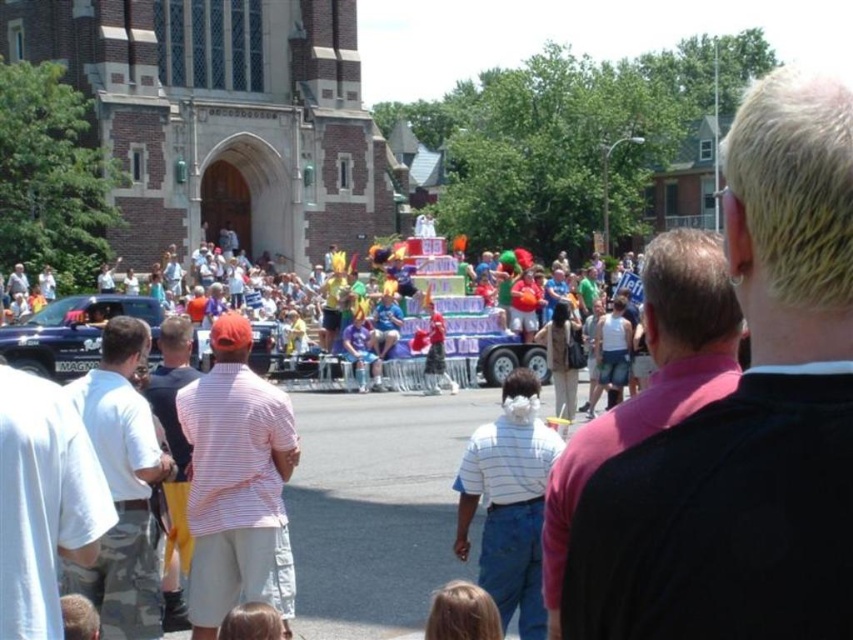
Between striped cotton shirt at center and metallic blue truck at left, which one has less height?

Standing shorter between the two is metallic blue truck at left.

Does striped cotton shirt at center have a greater width compared to metallic blue truck at left?

Correct, the width of striped cotton shirt at center exceeds that of metallic blue truck at left.

Is point (250, 524) closer to viewer compared to point (25, 355)?

Yes, it is in front of point (25, 355).

Find the location of `striped cotton shirt at center`. striped cotton shirt at center is located at coordinates (236, 481).

Who is positioned more to the right, pink fabric shirt at upper right or multicolored balloons at center?

From the viewer's perspective, pink fabric shirt at upper right appears more on the right side.

Which of these two, pink fabric shirt at upper right or multicolored balloons at center, stands taller?

pink fabric shirt at upper right is taller.

Locate an element on the screen. The width and height of the screenshot is (853, 640). pink fabric shirt at upper right is located at coordinates (747, 417).

The height and width of the screenshot is (640, 853). I want to click on pink fabric shirt at upper right, so click(x=747, y=417).

Who is positioned more to the left, multicolored balloons at center or pink fabric shirt at center?

Positioned to the left is multicolored balloons at center.

What do you see at coordinates (361, 323) in the screenshot? I see `multicolored balloons at center` at bounding box center [361, 323].

The height and width of the screenshot is (640, 853). Identify the location of multicolored balloons at center. (361, 323).

Where is `multicolored balloons at center`? multicolored balloons at center is located at coordinates (361, 323).